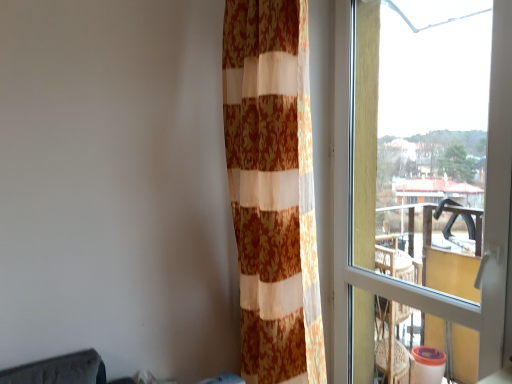
Question: Considering the positions of point (336, 155) and point (289, 76), is point (336, 155) closer or farther from the camera than point (289, 76)?

Choices:
 (A) farther
 (B) closer

Answer: (A)

Question: Considering their positions, is transparent glass window at right located in front of or behind orange floral fabric curtain at center?

Choices:
 (A) behind
 (B) front

Answer: (B)

Question: Considering the relative positions of transparent glass window at right and orange floral fabric curtain at center in the image provided, is transparent glass window at right to the left or to the right of orange floral fabric curtain at center?

Choices:
 (A) right
 (B) left

Answer: (A)

Question: Is orange floral fabric curtain at center inside or outside of transparent glass window at right?

Choices:
 (A) outside
 (B) inside

Answer: (A)

Question: From their relative heights in the image, would you say orange floral fabric curtain at center is taller or shorter than transparent glass window at right?

Choices:
 (A) tall
 (B) short

Answer: (A)

Question: Is orange floral fabric curtain at center wider or thinner than transparent glass window at right?

Choices:
 (A) thin
 (B) wide

Answer: (B)

Question: From the image's perspective, is orange floral fabric curtain at center above or below transparent glass window at right?

Choices:
 (A) above
 (B) below

Answer: (A)